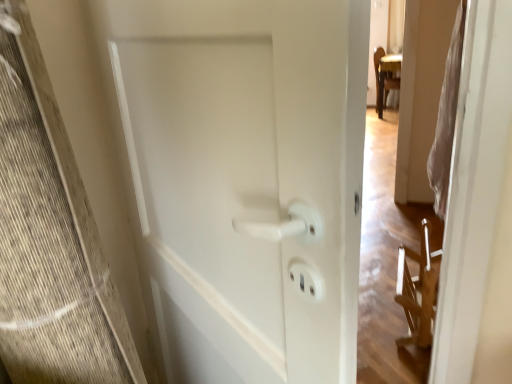
What do you see at coordinates (248, 179) in the screenshot? Image resolution: width=512 pixels, height=384 pixels. I see `white matte door handle at center` at bounding box center [248, 179].

At what (x,y) coordinates should I click in order to perform the action: click on white matte door handle at center. Please return your answer as a coordinate pair (x, y). The width and height of the screenshot is (512, 384). Looking at the image, I should click on (248, 179).

At what (x,y) coordinates should I click in order to perform the action: click on white matte door handle at center. Please return your answer as a coordinate pair (x, y). Looking at the image, I should click on (248, 179).